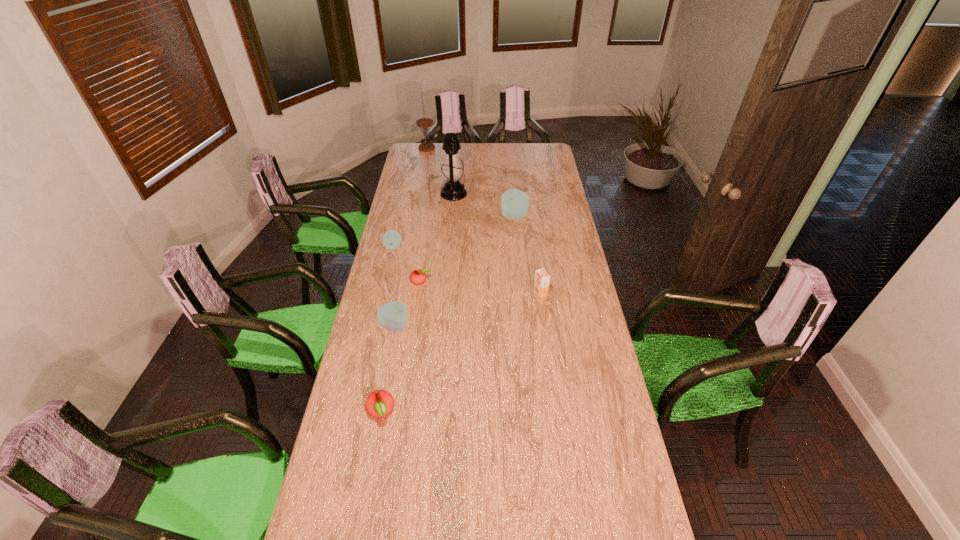
The image size is (960, 540). I want to click on object identified as the fourth closest to the fourth farthest object, so click(515, 203).

I want to click on apple that stands as the fourth closest to the nearer red apple, so click(515, 203).

You are a GUI agent. You are given a task and a screenshot of the screen. Output one action in this format:
    pyautogui.click(x=<x>, y=<y>)
    Task: Click on the apple that is the fourth closest to the sixth shortest object
    
    Given the screenshot: What is the action you would take?
    pyautogui.click(x=379, y=403)

The height and width of the screenshot is (540, 960). What are the coordinates of `white apple that stands as the third closest to the nearer red apple` in the screenshot? It's located at (515, 203).

At what (x,y) coordinates should I click in order to perform the action: click on white apple that stands as the second closest to the oil lamp. Please return your answer as a coordinate pair (x, y). Image resolution: width=960 pixels, height=540 pixels. Looking at the image, I should click on (391, 239).

The width and height of the screenshot is (960, 540). In order to click on vacant point that satisfies the following two spatial constraints: 1. on the back side of the nearer red apple; 2. on the right side of the farther red apple in this screenshot , I will do `click(404, 281)`.

Locate an element on the screen. free space that satisfies the following two spatial constraints: 1. on the back side of the farthest apple; 2. on the left side of the second farthest apple is located at coordinates (400, 217).

Where is `free location that satisfies the following two spatial constraints: 1. on the back side of the fifth nearest object; 2. on the left side of the oil lamp`? free location that satisfies the following two spatial constraints: 1. on the back side of the fifth nearest object; 2. on the left side of the oil lamp is located at coordinates (405, 194).